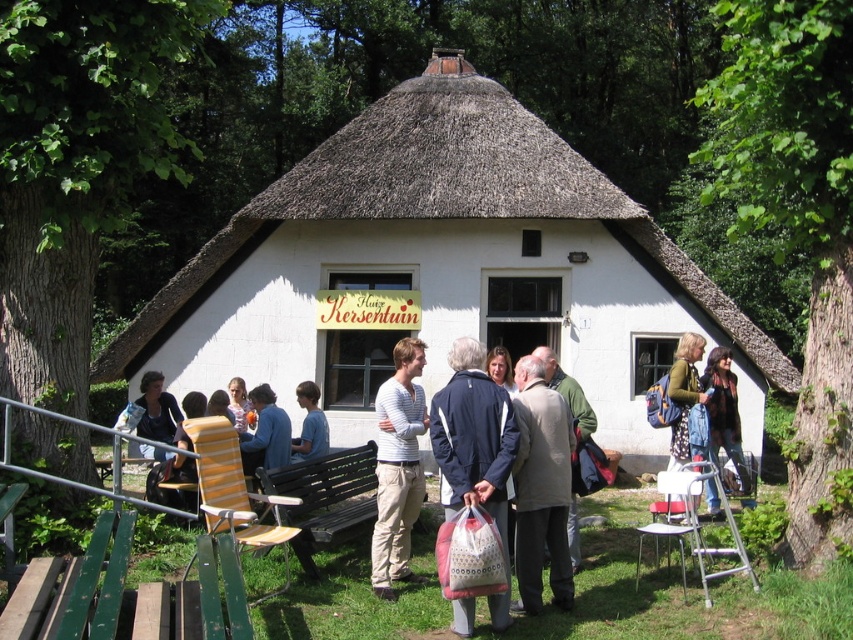
In the scene shown: Who is positioned more to the right, blue denim jacket at center or blue cotton shirt at center?

Positioned to the right is blue denim jacket at center.

Does blue denim jacket at center have a greater width compared to blue cotton shirt at center?

Incorrect, blue denim jacket at center's width does not surpass blue cotton shirt at center's.

Identify the location of blue denim jacket at center. (683, 394).

You are a GUI agent. You are given a task and a screenshot of the screen. Output one action in this format:
    pyautogui.click(x=<x>, y=<y>)
    Task: Click on the blue denim jacket at center
    The image size is (853, 640).
    Given the screenshot: What is the action you would take?
    pyautogui.click(x=683, y=394)

Who is positioned more to the right, blue denim shirt at center or light brown leather jacket at center?

light brown leather jacket at center

Does blue denim shirt at center appear on the right side of light brown leather jacket at center?

Incorrect, blue denim shirt at center is not on the right side of light brown leather jacket at center.

Locate an element on the screen. This screenshot has height=640, width=853. blue denim shirt at center is located at coordinates (265, 433).

You are a GUI agent. You are given a task and a screenshot of the screen. Output one action in this format:
    pyautogui.click(x=<x>, y=<y>)
    Task: Click on the blue denim shirt at center
    Image resolution: width=853 pixels, height=640 pixels.
    Given the screenshot: What is the action you would take?
    pyautogui.click(x=265, y=433)

Between blue denim jacket at center and light pink fabric dress at center, which one has less height?

Standing shorter between the two is light pink fabric dress at center.

Can you confirm if blue denim jacket at center is thinner than light pink fabric dress at center?

Correct, blue denim jacket at center's width is less than light pink fabric dress at center's.

Find the location of a particular element. The width and height of the screenshot is (853, 640). blue denim jacket at center is located at coordinates (683, 394).

Locate an element on the screen. The height and width of the screenshot is (640, 853). blue denim jacket at center is located at coordinates (683, 394).